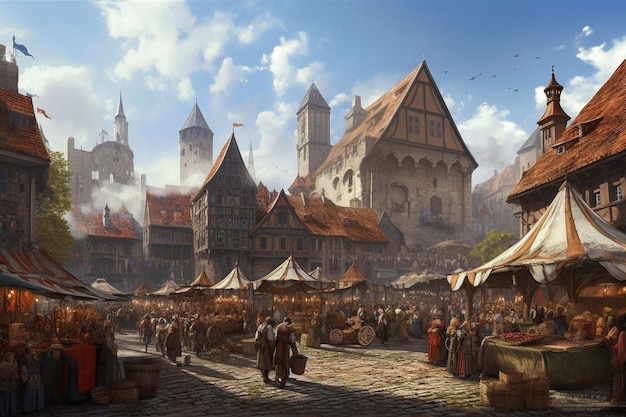
The width and height of the screenshot is (626, 417). I want to click on bucket, so click(302, 364).